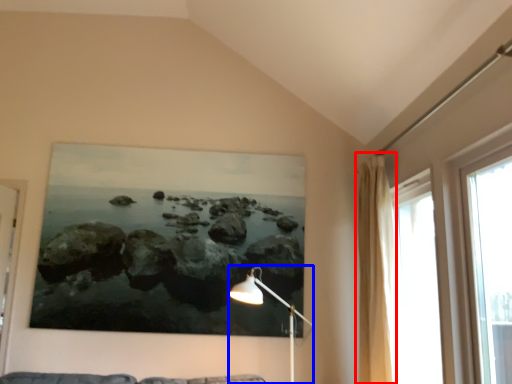
Question: Which point is closer to the camera, curtain (highlighted by a red box) or table lamp (highlighted by a blue box)?

Choices:
 (A) curtain
 (B) table lamp

Answer: (B)